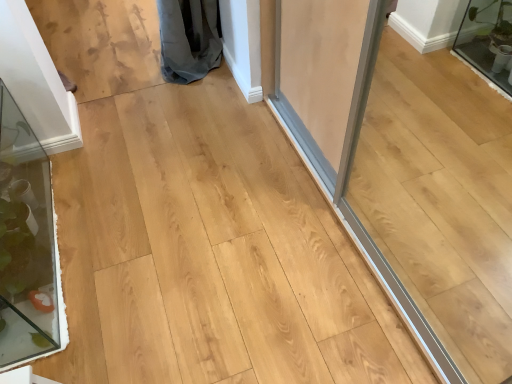
What are the coordinates of `free space to the back side of transparent glass at left` in the screenshot? It's located at (114, 152).